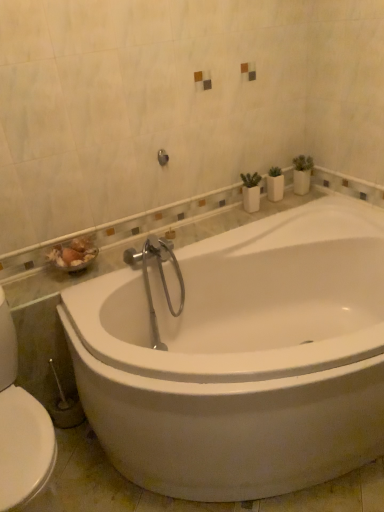
Question: Is white glossy bathtub at center taller or shorter than brushed metal shower at upper center?

Choices:
 (A) tall
 (B) short

Answer: (A)

Question: Is white glossy bathtub at center inside the boundaries of brushed metal shower at upper center, or outside?

Choices:
 (A) inside
 (B) outside

Answer: (B)

Question: Looking at the image, does white glossy bathtub at center seem bigger or smaller compared to brushed metal shower at upper center?

Choices:
 (A) small
 (B) big

Answer: (B)

Question: From the image's perspective, is brushed metal shower at upper center above or below white glossy bathtub at center?

Choices:
 (A) above
 (B) below

Answer: (A)

Question: Is brushed metal shower at upper center in front of or behind white glossy bathtub at center in the image?

Choices:
 (A) behind
 (B) front

Answer: (A)

Question: Is brushed metal shower at upper center to the left or to the right of white glossy bathtub at center in the image?

Choices:
 (A) left
 (B) right

Answer: (A)

Question: From a real-world perspective, is brushed metal shower at upper center physically located above or below white glossy bathtub at center?

Choices:
 (A) above
 (B) below

Answer: (A)